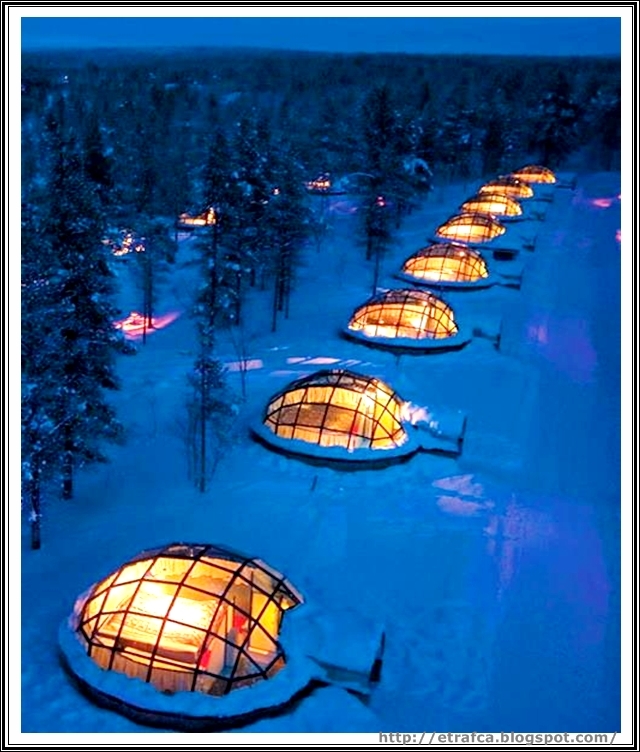
You are a GUI agent. You are given a task and a screenshot of the screen. Output one action in this format:
    pyautogui.click(x=<x>, y=<y>)
    Task: Click on the entry way
    This screenshot has height=752, width=640.
    Given the screenshot: What is the action you would take?
    pyautogui.click(x=358, y=650)